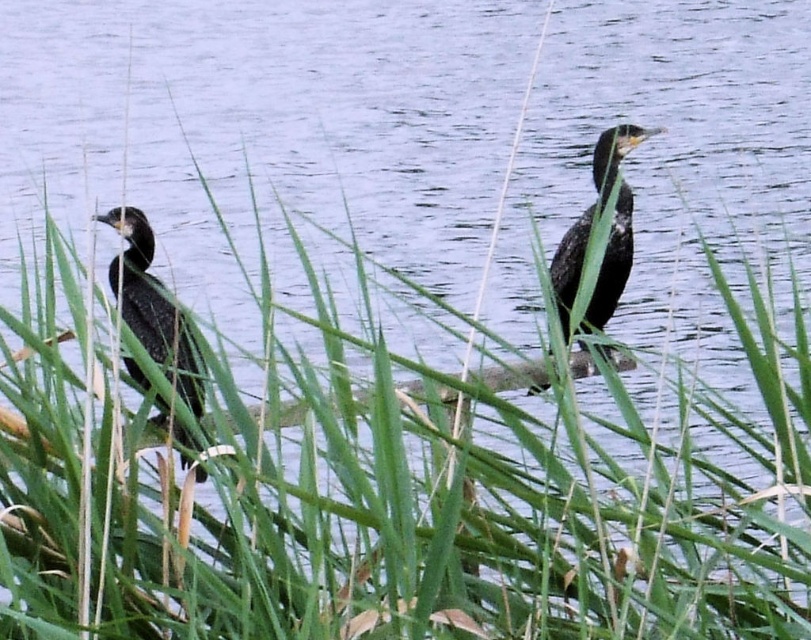
Which is in front, point (127, 291) or point (597, 189)?

Point (127, 291)

Is shiny black bird at left bigger than shiny black bird at center?

No, shiny black bird at left is not bigger than shiny black bird at center.

Which is behind, point (116, 288) or point (612, 132)?

The point (612, 132) is more distant.

Where is `shiny black bird at left`? shiny black bird at left is located at coordinates (151, 305).